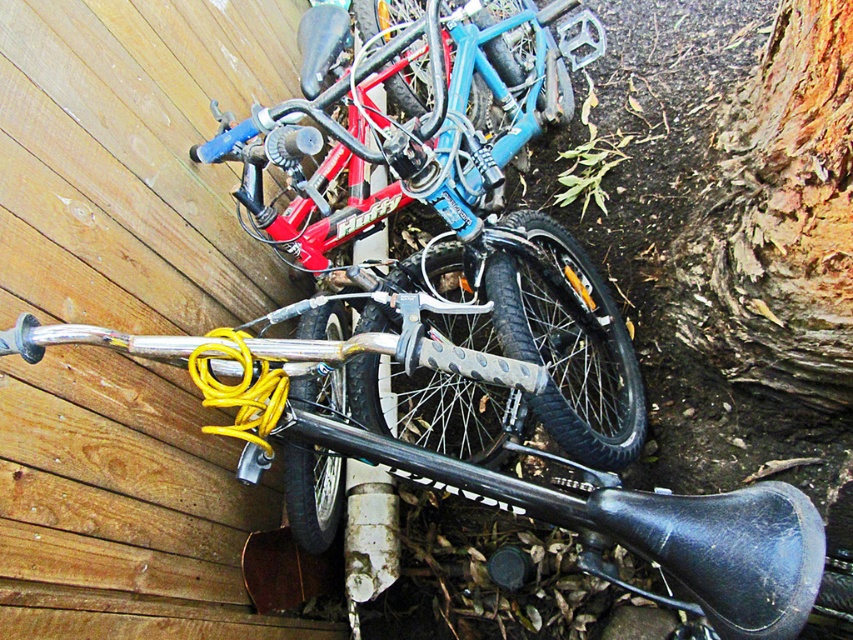
You are a painter standing in front of the wooden wall. You want to paint the brown rough bark at lower right but need to ensure there is enough space between it and the matte blue bicycle at center. Based on the scene, can you confirm if the distance allows you to paint without the bicycle obstructing the bark?

The matte blue bicycle at center has a greater height compared to brown rough bark at lower right. Since the bicycle is taller, it might block your view or access to the bark, making it difficult to paint without moving the bicycle first.